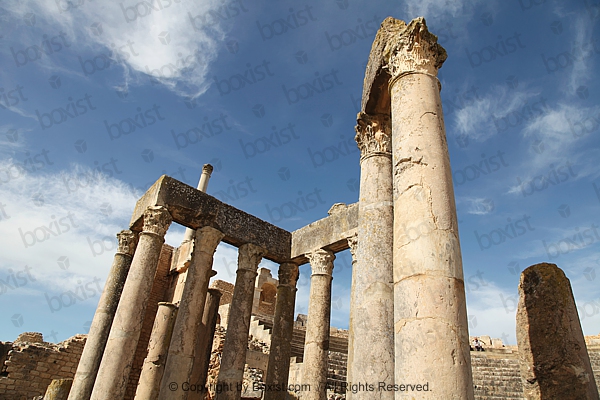
Locate an element on the screen. The width and height of the screenshot is (600, 400). pillar is located at coordinates (237, 353).